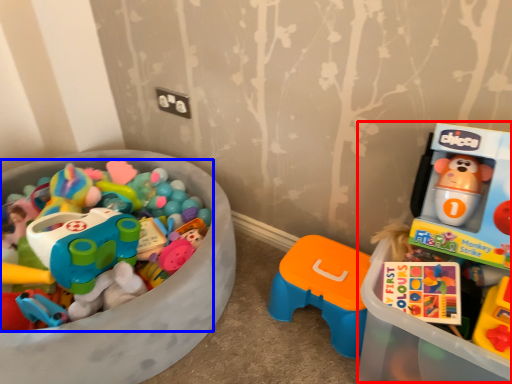
Question: Which point is closer to the camera, toyshop (highlighted by a red box) or toy (highlighted by a blue box)?

Choices:
 (A) toyshop
 (B) toy

Answer: (A)